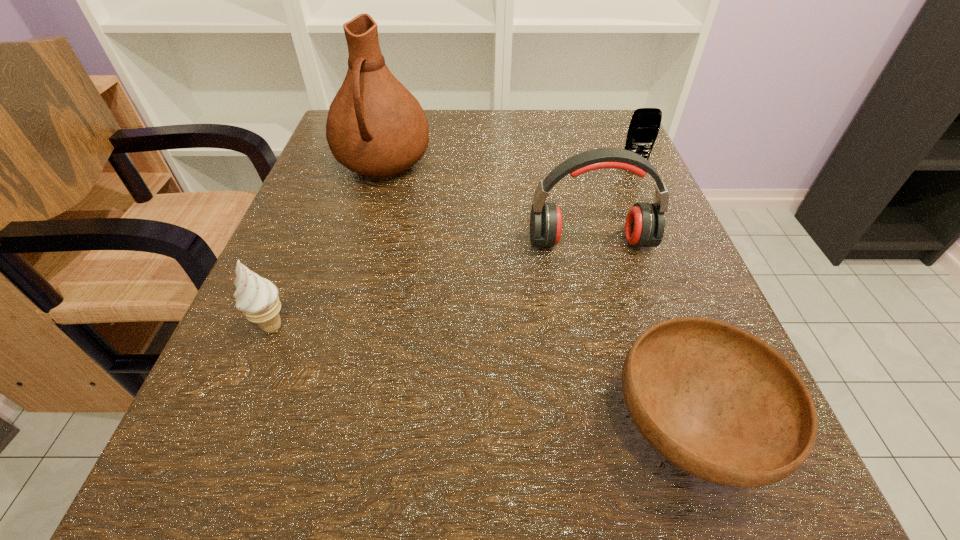
This screenshot has width=960, height=540. What are the coordinates of `unoccupied area between the pitcher and the fourth shortest object` in the screenshot? It's located at (487, 203).

The width and height of the screenshot is (960, 540). In order to click on vacant area that lies between the cellular telephone and the pitcher in this screenshot , I will do `click(508, 166)`.

Identify the location of vacant area that lies between the pitcher and the shortest object. coord(536,296).

Identify the location of free area in between the pitcher and the second nearest object. This screenshot has width=960, height=540. (328, 245).

At what (x,y) coordinates should I click in order to perform the action: click on free space between the cellular telephone and the icecream. Please return your answer as a coordinate pair (x, y). The height and width of the screenshot is (540, 960). Looking at the image, I should click on (453, 247).

Where is `vacant region between the icecream and the bowl`? The image size is (960, 540). vacant region between the icecream and the bowl is located at coordinates (480, 377).

Where is `free spot between the earphone and the nearest object`? The height and width of the screenshot is (540, 960). free spot between the earphone and the nearest object is located at coordinates (639, 336).

Where is `vacant space that's between the tallest object and the second tallest object`? vacant space that's between the tallest object and the second tallest object is located at coordinates (487, 203).

Identify the location of the fourth closest object to the second nearest object. Image resolution: width=960 pixels, height=540 pixels. (644, 126).

Where is `object that is the second closest to the cellular telephone`? The width and height of the screenshot is (960, 540). object that is the second closest to the cellular telephone is located at coordinates (375, 127).